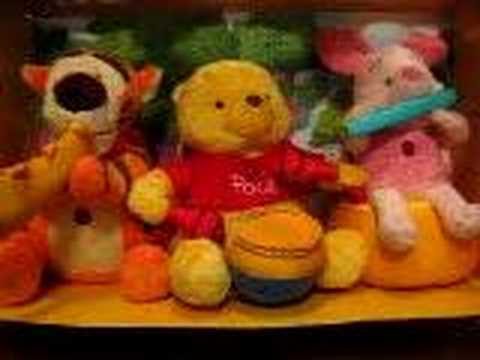
The width and height of the screenshot is (480, 360). In order to click on stuff animals in this screenshot , I will do `click(109, 103)`, `click(226, 115)`, `click(387, 107)`, `click(313, 117)`.